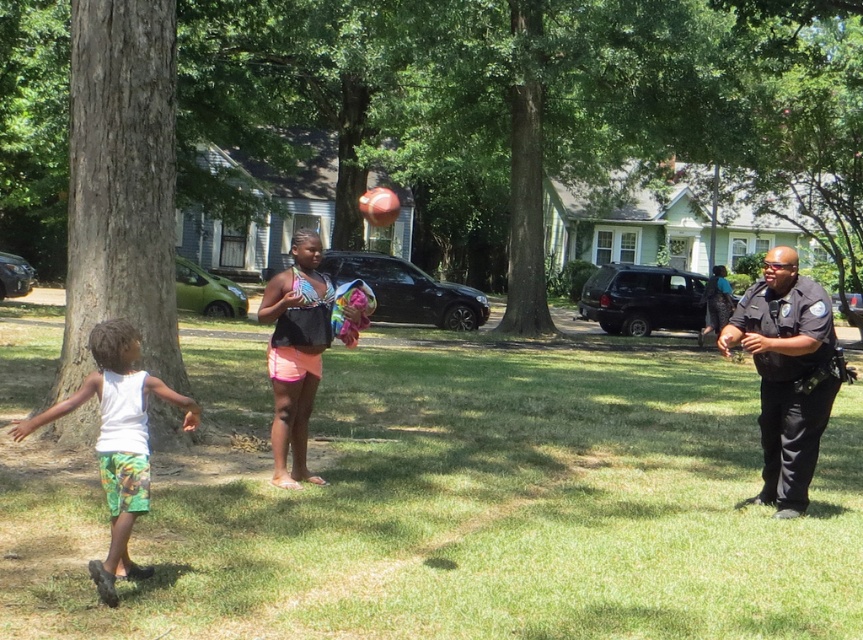
You are standing at the center of the image and want to reach the brown rough tree at center. Which direction should you move to get there?

The brown rough tree at center is already at the center of the image, so you don not need to move in any direction to reach it.